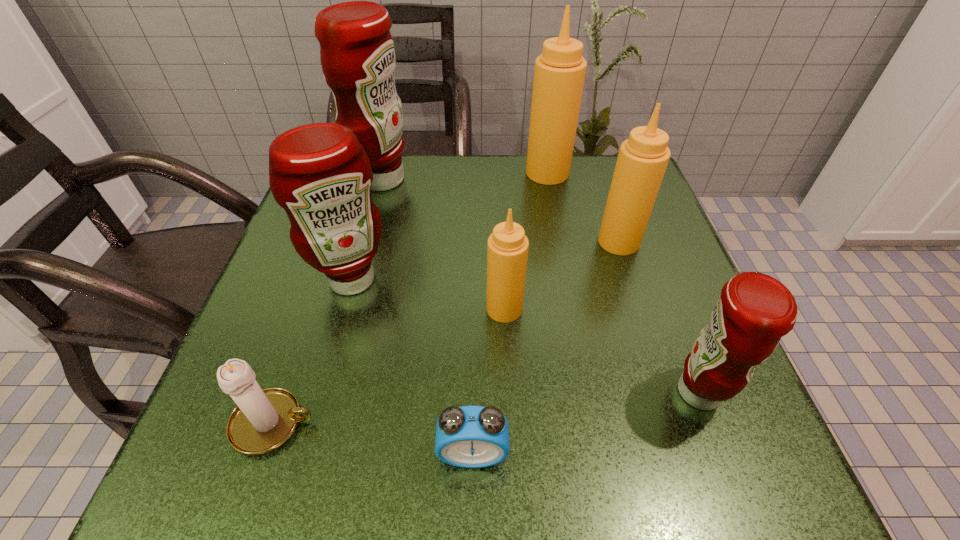
In the image, there is a desktop. At what (x,y) coordinates should I click in order to perform the action: click on vacant space at the right edge. Please return your answer as a coordinate pair (x, y). This screenshot has height=540, width=960. Looking at the image, I should click on (693, 292).

The height and width of the screenshot is (540, 960). I want to click on vacant space at the near left corner, so click(x=307, y=438).

At what (x,y) coordinates should I click in order to perform the action: click on vacant space at the far right corner of the desktop. Please return your answer as a coordinate pair (x, y). Image resolution: width=960 pixels, height=540 pixels. Looking at the image, I should click on (590, 179).

At what (x,y) coordinates should I click in order to perform the action: click on vacant space at the near right corner. Please return your answer as a coordinate pair (x, y). This screenshot has width=960, height=540. Looking at the image, I should click on (730, 462).

Find the location of a particular element. The width and height of the screenshot is (960, 540). free space between the smallest red condiment and the second smallest red condiment is located at coordinates (526, 336).

The height and width of the screenshot is (540, 960). I want to click on free area in between the leftmost tan condiment and the farthest red condiment, so click(x=444, y=244).

Identify the location of free space that is in between the fourth condiment from right to left and the candle holder. The width and height of the screenshot is (960, 540). (389, 366).

The image size is (960, 540). In order to click on free point between the rightmost tan condiment and the second farthest red condiment in this screenshot , I will do `click(486, 261)`.

Locate an element on the screen. This screenshot has height=540, width=960. free space between the fourth nearest condiment and the rightmost red condiment is located at coordinates (659, 317).

At what (x,y) coordinates should I click in order to perform the action: click on blank region between the candle holder and the second tan condiment from right to left. Please return your answer as a coordinate pair (x, y). Looking at the image, I should click on (411, 298).